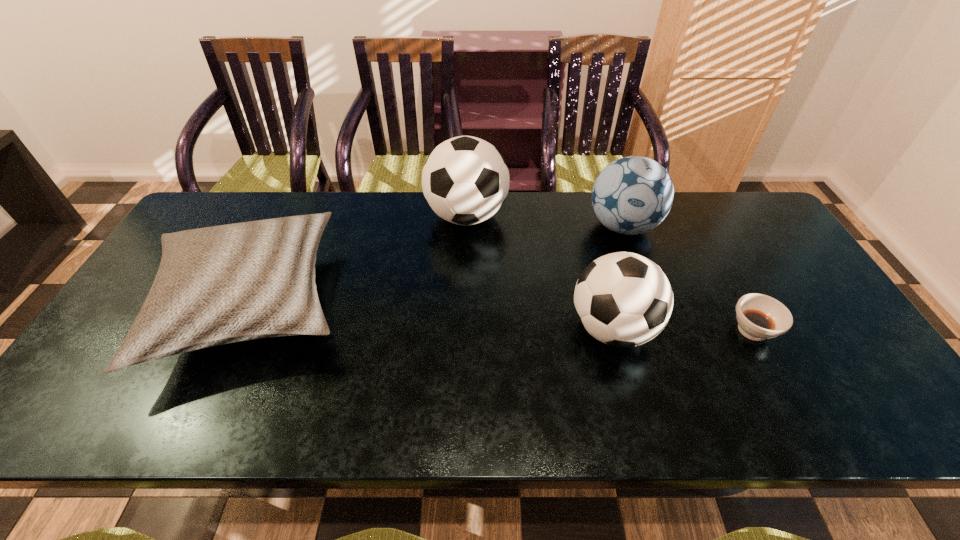
The image size is (960, 540). Identify the location of the second object from left to right. (465, 180).

The image size is (960, 540). Identify the location of the nearest soccer ball. (623, 299).

This screenshot has height=540, width=960. I want to click on cushion, so click(216, 285).

In order to click on the second shortest object in this screenshot , I will do `click(216, 285)`.

Locate an element on the screen. the shortest object is located at coordinates (759, 317).

At what (x,y) coordinates should I click in order to perform the action: click on soup bowl. Please return your answer as a coordinate pair (x, y). The image size is (960, 540). Looking at the image, I should click on (759, 317).

Locate an element on the screen. Image resolution: width=960 pixels, height=540 pixels. vacant position located on the right of the leftmost soccer ball is located at coordinates (628, 216).

You are a GUI agent. You are given a task and a screenshot of the screen. Output one action in this format:
    pyautogui.click(x=<x>, y=<y>)
    Task: Click on the free location located 0.310m on the left of the nearest soccer ball
    The image size is (960, 540).
    Given the screenshot: What is the action you would take?
    pyautogui.click(x=445, y=328)

This screenshot has width=960, height=540. I want to click on free point located 0.060m on the right of the second shortest object, so click(x=376, y=304).

Identify the location of vacant area located on the front of the rightmost object. (787, 395).